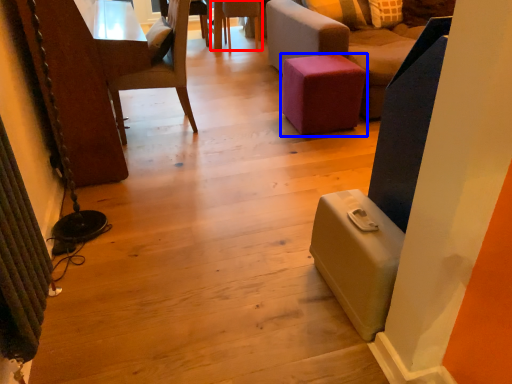
Question: Which object is closer to the camera taking this photo, chair (highlighted by a red box) or furniture (highlighted by a blue box)?

Choices:
 (A) chair
 (B) furniture

Answer: (B)